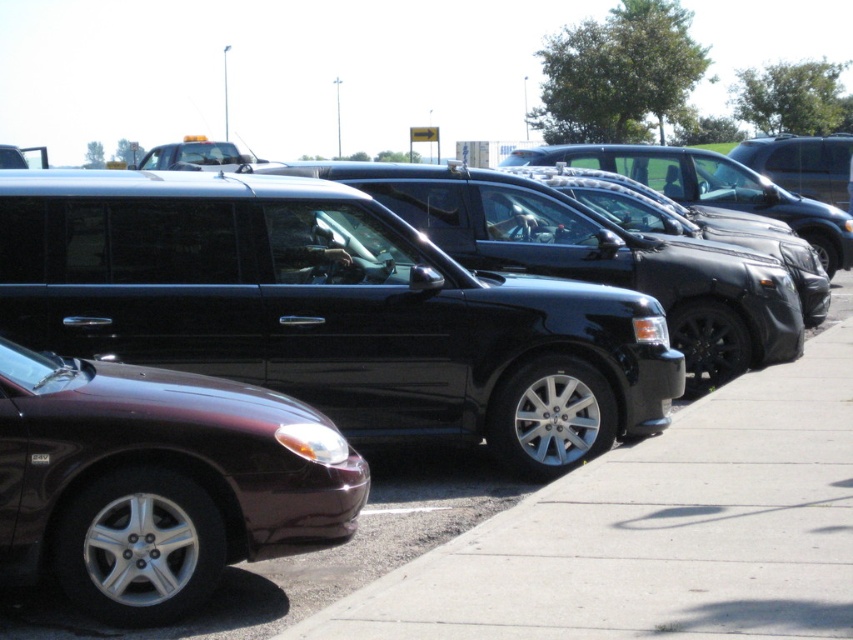
Based on the photo, you are a delivery person trying to park your van in the parking lot. The shiny maroon sedan at lower left and the black asphalt pavement at center are both in your path. Which area has more space for your van to maneuver?

The black asphalt pavement at center has more space since the shiny maroon sedan at lower left occupies less space than it.

You are standing at the point marked by the coordinates point (158, 481) in the parking lot. What vehicle are you closest to?

The point (158, 481) marks the shiny maroon sedan at lower left, so you are closest to the shiny maroon sedan at lower left.

You are standing at the camera position and want to take a picture of the shiny maroon sedan at lower left. The parking lot has a rule that you must be at least 10 feet away from any vehicle when taking photos. Is your current position compliant with the parking lot rules?

The shiny maroon sedan at lower left and camera are 15.87 feet apart, which is more than the required 10 feet distance. Therefore, your current position is compliant with the parking lot rules.